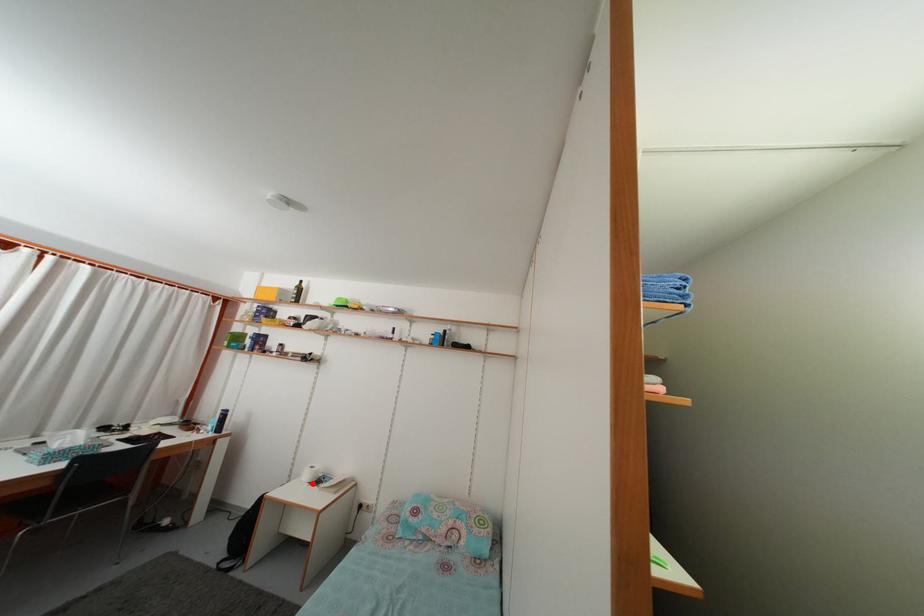
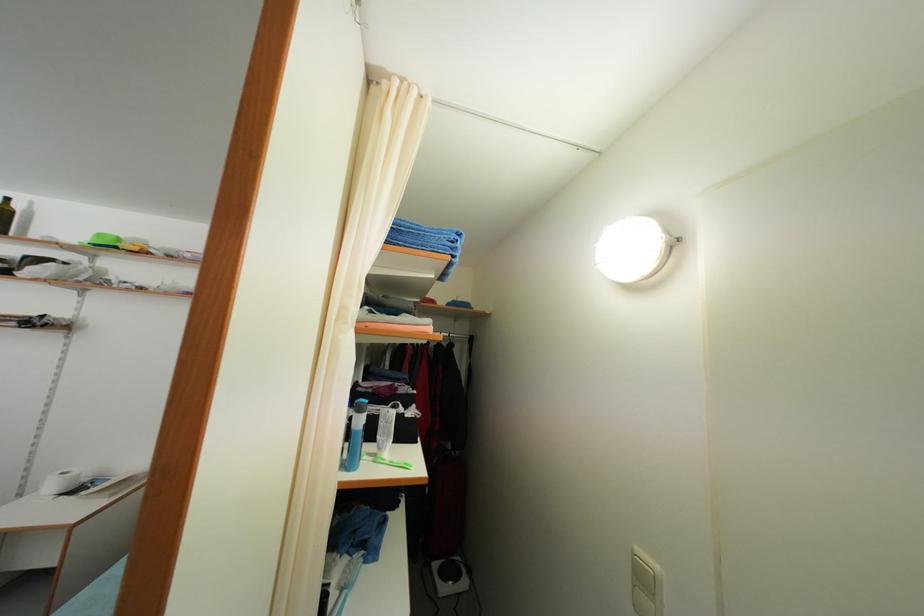
Locate, in the second image, the point that corresponds to the highlighted location in the first image.

(56, 493)